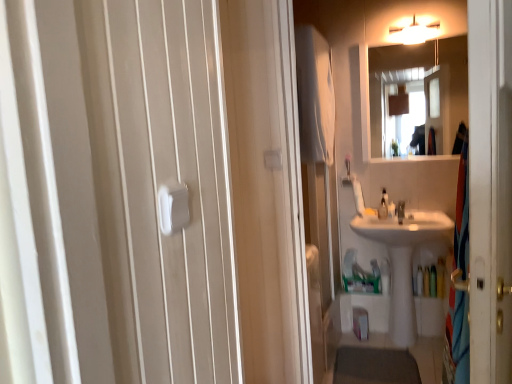
Question: Considering their positions, is white glossy sink at center located in front of or behind translucent plastic bottle at lower right, which is the first toiletry from right to left?

Choices:
 (A) front
 (B) behind

Answer: (A)

Question: From their relative heights in the image, would you say white glossy sink at center is taller or shorter than translucent plastic bottle at lower right, which is the first toiletry from right to left?

Choices:
 (A) tall
 (B) short

Answer: (A)

Question: Considering the real-world distances, which object is closest to the transparent plastic screen door at right?

Choices:
 (A) white plastic towel bar at center
 (B) translucent plastic bottle at right, which is counted as the 1th toiletry, starting from the left
 (C) translucent plastic bottle at lower right, which is the first toiletry from right to left
 (D) white glossy mirror at upper center
 (E) white soft towel at upper center

Answer: (A)

Question: Estimate the real-world distances between objects in this image. Which object is farther from the translucent plastic bottle at right, the second toiletry from the right?

Choices:
 (A) translucent plastic soap dispenser at center
 (B) white plastic towel bar at center
 (C) white glossy mirror at upper center
 (D) translucent plastic bottle at lower right, which is the first toiletry from right to left
 (E) transparent plastic screen door at right

Answer: (B)